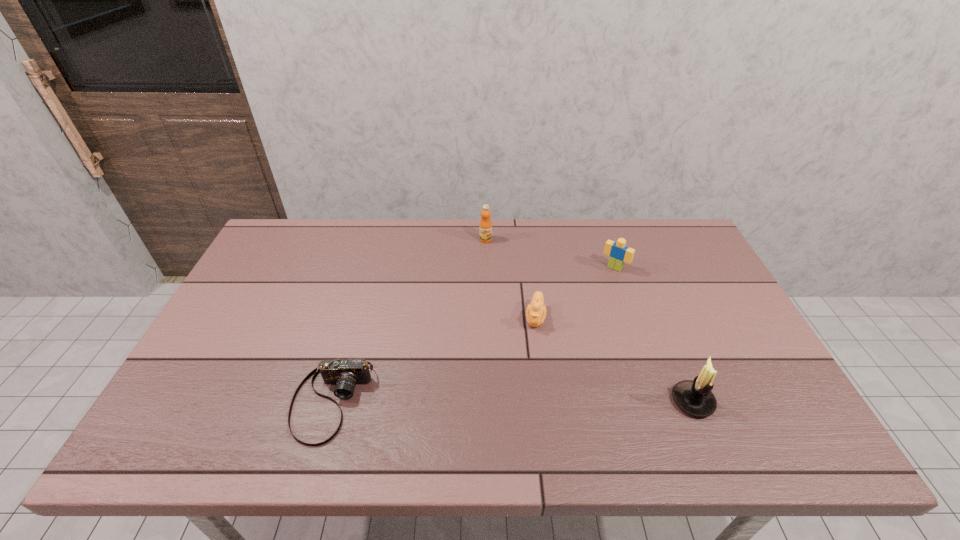
Find the location of a particular element. This screenshot has height=540, width=960. vacant space that satisfies the following two spatial constraints: 1. on the back side of the duckling; 2. on the right side of the Lego is located at coordinates (529, 268).

This screenshot has width=960, height=540. I want to click on free point that satisfies the following two spatial constraints: 1. on the front side of the third tallest object; 2. on the left side of the candle holder, so click(660, 401).

Find the location of a particular element. blank space that satisfies the following two spatial constraints: 1. on the front-facing side of the leftmost object; 2. on the left side of the candle holder is located at coordinates (332, 401).

Locate an element on the screen. The width and height of the screenshot is (960, 540). free space that satisfies the following two spatial constraints: 1. on the front-facing side of the leftmost object; 2. on the left side of the candle holder is located at coordinates (332, 401).

Identify the location of free spot that satisfies the following two spatial constraints: 1. on the back side of the third farthest object; 2. on the right side of the third tallest object. (529, 268).